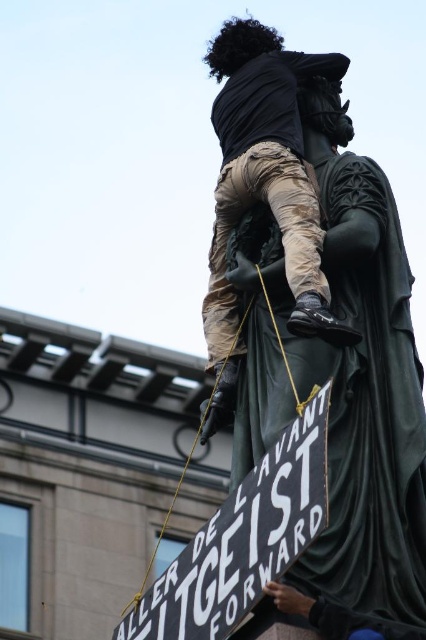
Can you confirm if green marble statue at center is thinner than black matte sign at center?

Yes.

Locate an element on the screen. green marble statue at center is located at coordinates (344, 390).

Is point (331, 563) positioned in front of point (258, 577)?

No, it is behind (258, 577).

I want to click on green marble statue at center, so click(344, 390).

Where is `camouflage pants at upper center`? Image resolution: width=426 pixels, height=640 pixels. camouflage pants at upper center is located at coordinates (262, 192).

Can you confirm if camouflage pants at upper center is wider than black matte sign at center?

In fact, camouflage pants at upper center might be narrower than black matte sign at center.

Locate an element on the screen. camouflage pants at upper center is located at coordinates (262, 192).

Who is more distant from viewer, (x=391, y=500) or (x=301, y=289)?

Positioned behind is point (x=301, y=289).

Can you confirm if green marble statue at center is smaller than camouflage pants at upper center?

Correct, green marble statue at center occupies less space than camouflage pants at upper center.

At what (x,y) coordinates should I click in order to perform the action: click on green marble statue at center. Please return your answer as a coordinate pair (x, y). This screenshot has width=426, height=640. Looking at the image, I should click on (344, 390).